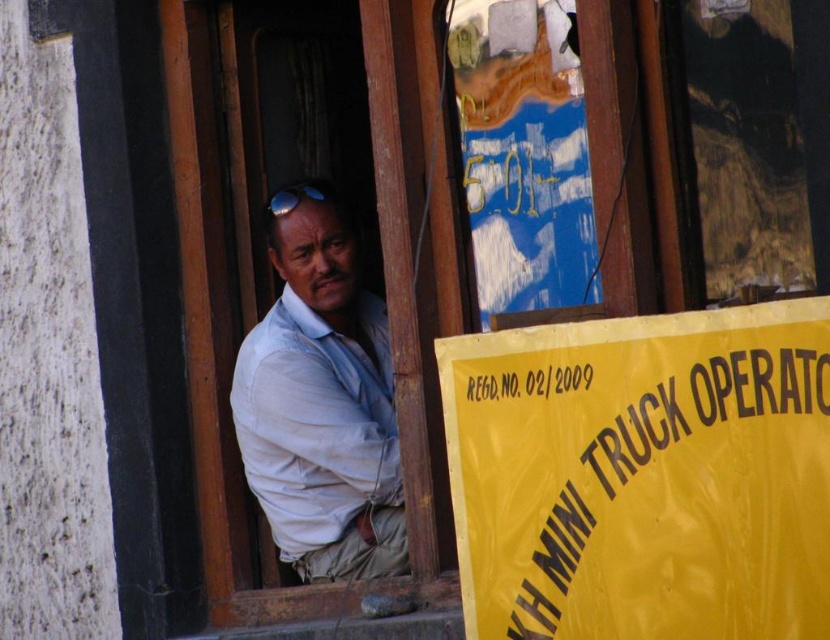
You are a delivery person trying to read the yellow paper sign at lower right while looking at the light blue shirt at center. Can you tell which object is wider?

The yellow paper sign at lower right is wider than the light blue shirt at center.

You are standing in front of the doorway and notice a yellow paper sign at lower right and a light blue shirt at center. Which object is shorter in height?

The yellow paper sign at lower right is shorter than the light blue shirt at center.